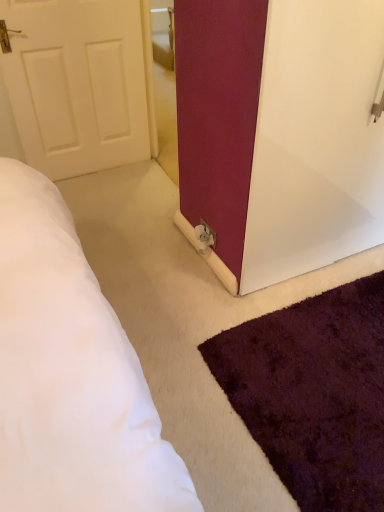
Describe the element at coordinates (313, 393) in the screenshot. The width and height of the screenshot is (384, 512). I see `shaggy purple rug at lower right` at that location.

Where is `shaggy purple rug at lower right`? shaggy purple rug at lower right is located at coordinates (313, 393).

Looking at this image, in order to face white glossy door at center, should I rotate leftwards or rightwards?

You should look right and rotate roughly 16.822 degrees.

Identify the location of white glossy door at center. (280, 132).

Image resolution: width=384 pixels, height=512 pixels. What do you see at coordinates (280, 132) in the screenshot?
I see `white glossy door at center` at bounding box center [280, 132].

Find the location of a particular element. Image resolution: width=384 pixels, height=512 pixels. shaggy purple rug at lower right is located at coordinates (313, 393).

Which is more to the right, shaggy purple rug at lower right or white glossy door at center?

shaggy purple rug at lower right is more to the right.

Is shaggy purple rug at lower right behind white glossy door at center?

No, shaggy purple rug at lower right is closer to the camera.

Does point (273, 370) come farther from viewer compared to point (251, 111)?

Yes, it is.

From the image's perspective, is shaggy purple rug at lower right located above or below white glossy door at center?

shaggy purple rug at lower right is situated lower than white glossy door at center in the image.

From a real-world perspective, is shaggy purple rug at lower right beneath white glossy door at center?

Indeed, from a real-world perspective, shaggy purple rug at lower right is positioned beneath white glossy door at center.

In the scene shown: In terms of width, does shaggy purple rug at lower right look wider or thinner when compared to white glossy door at center?

In the image, shaggy purple rug at lower right appears to be wider than white glossy door at center.

Who is taller, shaggy purple rug at lower right or white glossy door at center?

white glossy door at center is taller.

Does shaggy purple rug at lower right have a smaller size compared to white glossy door at center?

Indeed, shaggy purple rug at lower right has a smaller size compared to white glossy door at center.

Is shaggy purple rug at lower right surrounding white glossy door at center?

Actually, white glossy door at center is outside shaggy purple rug at lower right.

Would you consider shaggy purple rug at lower right to be distant from white glossy door at center?

shaggy purple rug at lower right is actually quite close to white glossy door at center.

Is shaggy purple rug at lower right oriented away from white glossy door at center?

shaggy purple rug at lower right is not turned away from white glossy door at center.

How many degrees apart are the facing directions of shaggy purple rug at lower right and white glossy door at center?

The facing directions of shaggy purple rug at lower right and white glossy door at center are 90.8 degrees apart.

Find the location of `door behind the shaggy purple rug at lower right`. door behind the shaggy purple rug at lower right is located at coordinates (280, 132).

In the scene shown: Is white glossy door at center to the left of shaggy purple rug at lower right from the viewer's perspective?

Yes, white glossy door at center is to the left of shaggy purple rug at lower right.

Between white glossy door at center and shaggy purple rug at lower right, which one is positioned in front?

shaggy purple rug at lower right is more forward.

Is point (242, 228) farther from camera compared to point (380, 343)?

Yes, point (242, 228) is farther from viewer.

From the image's perspective, which object appears higher, white glossy door at center or shaggy purple rug at lower right?

white glossy door at center appears higher in the image.

From a real-world perspective, between white glossy door at center and shaggy purple rug at lower right, who is vertically higher?

white glossy door at center.

Between white glossy door at center and shaggy purple rug at lower right, which one has smaller width?

Thinner between the two is white glossy door at center.

Between white glossy door at center and shaggy purple rug at lower right, which one has more height?

Standing taller between the two is white glossy door at center.

Between white glossy door at center and shaggy purple rug at lower right, which one has larger size?

white glossy door at center.

Would you say white glossy door at center contains shaggy purple rug at lower right?

No, shaggy purple rug at lower right is not a part of white glossy door at center.

Is white glossy door at center with shaggy purple rug at lower right?

No.

Based on the photo, does white glossy door at center turn towards shaggy purple rug at lower right?

Yes, white glossy door at center faces towards shaggy purple rug at lower right.

What's the angular difference between white glossy door at center and shaggy purple rug at lower right's facing directions?

The facing directions of white glossy door at center and shaggy purple rug at lower right are 90.8 degrees apart.

The height and width of the screenshot is (512, 384). I want to click on mat directly beneath the white glossy door at center (from a real-world perspective), so click(x=313, y=393).

Locate an element on the screen. door above the shaggy purple rug at lower right (from a real-world perspective) is located at coordinates (280, 132).

Locate an element on the screen. The height and width of the screenshot is (512, 384). mat on the right of white glossy door at center is located at coordinates (313, 393).